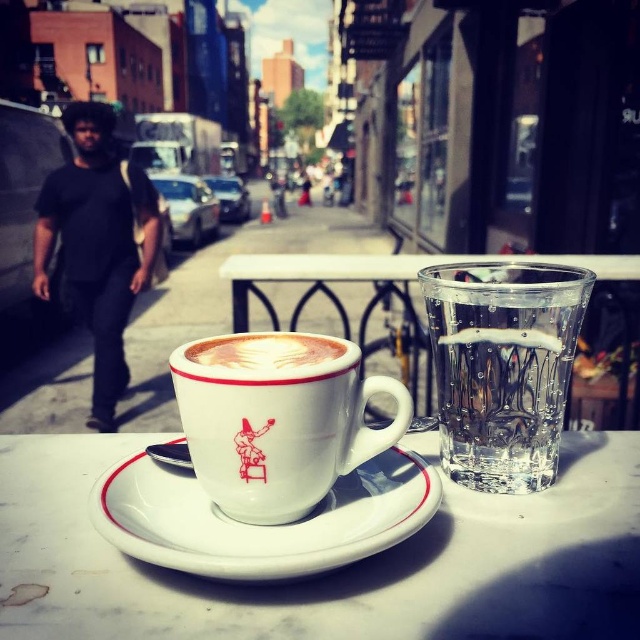
You are at an outdoor cafe and want to place a napkin between the white ceramic mug at center and the white ceramic saucer at center. Since the saucer is larger, where should you place the napkin to ensure it fits under both?

The white ceramic mug at center has a smaller size compared to the white ceramic saucer at center, so placing the napkin under the saucer would accommodate both items since the saucer is larger and can cover the napkin while the mug sits beside it.

You are sitting at an outdoor table and want to place your phone on the table without blocking the view of the street. The white ceramic mug at center is in the way. Where should you move the mug to ensure your phone can be placed without blocking the view?

Move the white ceramic mug at center to the left or right to create space for your phone while keeping it within the table area.